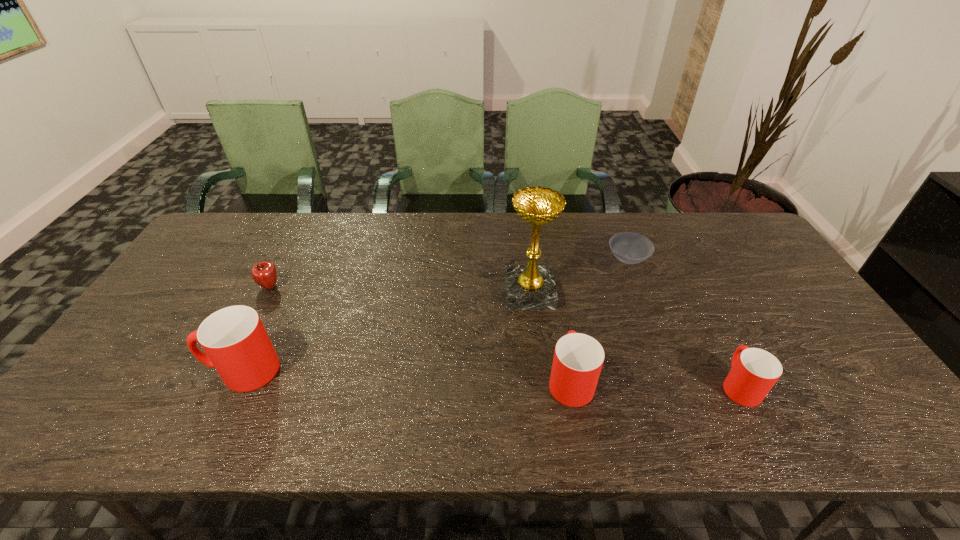
At what (x,y) coordinates should I click in order to perform the action: click on vacant space located 0.180m on the side of the leftmost cup with the handle. Please return your answer as a coordinate pair (x, y). Looking at the image, I should click on (132, 370).

This screenshot has height=540, width=960. Find the location of `vacant position located 0.170m on the side of the leftmost cup with the handle`. vacant position located 0.170m on the side of the leftmost cup with the handle is located at coordinates (136, 370).

Where is `vacant space located 0.080m on the side of the leftmost cup with the handle`? This screenshot has height=540, width=960. vacant space located 0.080m on the side of the leftmost cup with the handle is located at coordinates (173, 370).

Image resolution: width=960 pixels, height=540 pixels. Identify the location of vacant space situated 0.160m on the side of the second cup from left to right with the handle. (558, 310).

Identify the location of free space located 0.290m on the side of the second cup from left to right with the handle. (552, 279).

Locate an element on the screen. The width and height of the screenshot is (960, 540). vacant region located 0.280m on the side of the second cup from left to right with the handle is located at coordinates (552, 281).

Find the location of a particular element. The image size is (960, 540). free spot located 0.100m on the side of the rightmost object with the handle is located at coordinates point(713,334).

Identify the location of vacant space located 0.240m on the side of the rightmost object with the handle. (694, 297).

Identify the location of vacant area situated on the side of the rightmost object with the handle. Image resolution: width=960 pixels, height=540 pixels. (x=705, y=318).

Locate an element on the screen. vacant space located on the right of the fifth object from left to right is located at coordinates (674, 259).